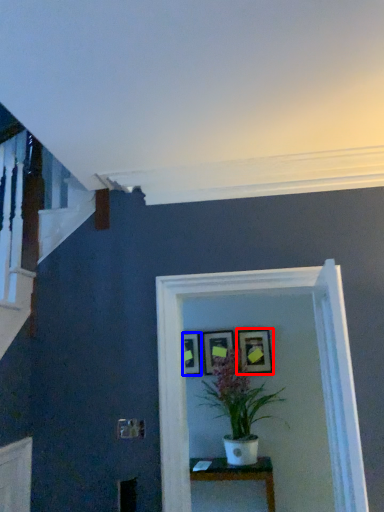
Question: Which object is further to the camera taking this photo, picture frame (highlighted by a red box) or picture frame (highlighted by a blue box)?

Choices:
 (A) picture frame
 (B) picture frame

Answer: (B)